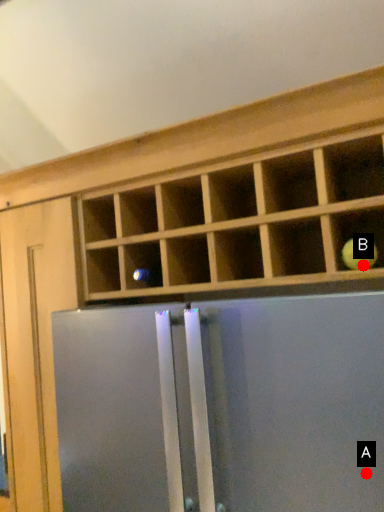
Question: Two points are circled on the image, labeled by A and B beside each circle. Which point is further to the camera?

Choices:
 (A) A is further
 (B) B is further

Answer: (B)